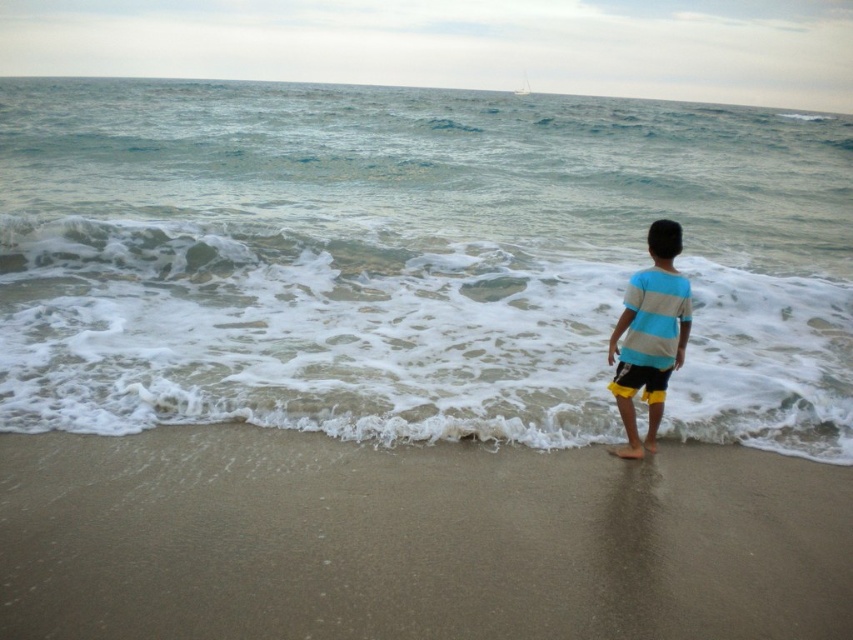
Question: Is clear blue water at center smaller than brown sandy beach at lower center?

Choices:
 (A) no
 (B) yes

Answer: (A)

Question: Which of the following is the farthest from the observer?

Choices:
 (A) clear blue water at center
 (B) striped cotton shirt at center

Answer: (A)

Question: Is brown sandy beach at lower center further to the viewer compared to striped cotton shirt at center?

Choices:
 (A) no
 (B) yes

Answer: (A)

Question: Can you confirm if clear blue water at center is wider than brown sandy beach at lower center?

Choices:
 (A) yes
 (B) no

Answer: (A)

Question: Among these objects, which one is nearest to the camera?

Choices:
 (A) clear blue water at center
 (B) yellow fabric shorts at lower right

Answer: (A)

Question: Considering the real-world distances, which object is closest to the striped cotton shirt at center?

Choices:
 (A) yellow fabric shorts at lower right
 (B) brown sandy beach at lower center
 (C) clear blue water at center

Answer: (A)